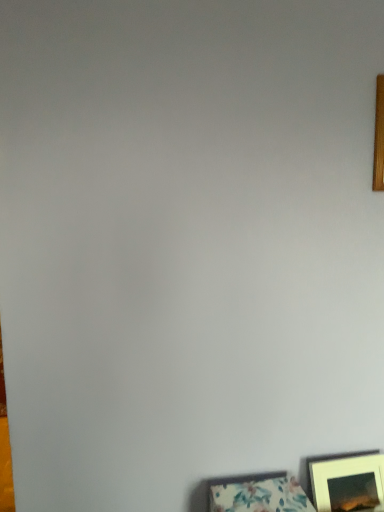
Identify the location of wooden frame at upper right, which is the first picture frame from right to left. The width and height of the screenshot is (384, 512). (379, 137).

The image size is (384, 512). I want to click on floral fabric picture frame at lower right, positioned as the 1th picture frame in bottom-to-top order, so click(259, 494).

In order to face matte white picture frame at lower right, the 2th picture frame viewed from the top, should I rotate leftwards or rightwards?

Rotate your view right by about 21.003°.

Find the location of a particular element. The width and height of the screenshot is (384, 512). wooden frame at upper right, which is the first picture frame from right to left is located at coordinates (379, 137).

In the scene shown: Are floral fabric picture frame at lower right, which is the first picture frame in left-to-right order, and wooden frame at upper right, which is the first picture frame from right to left, beside each other?

floral fabric picture frame at lower right, which is the first picture frame in left-to-right order, is not next to wooden frame at upper right, which is the first picture frame from right to left, and they're not touching.

Is floral fabric picture frame at lower right, which is the first picture frame in left-to-right order, taller or shorter than wooden frame at upper right, positioned as the third picture frame in bottom-to-top order?

floral fabric picture frame at lower right, which is the first picture frame in left-to-right order, is shorter than wooden frame at upper right, positioned as the third picture frame in bottom-to-top order.

Measure the distance between floral fabric picture frame at lower right, positioned as the 1th picture frame in bottom-to-top order, and wooden frame at upper right, the 3th picture frame positioned from the left.

floral fabric picture frame at lower right, positioned as the 1th picture frame in bottom-to-top order, and wooden frame at upper right, the 3th picture frame positioned from the left, are 35.07 inches apart from each other.

Is wooden frame at upper right, which is the first picture frame from right to left, inside floral fabric picture frame at lower right, placed as the 3th picture frame when sorted from top to bottom?

Definitely not — wooden frame at upper right, which is the first picture frame from right to left, is not inside floral fabric picture frame at lower right, placed as the 3th picture frame when sorted from top to bottom.

Does matte white picture frame at lower right, marked as the 2th picture frame in a bottom-to-top arrangement, lie behind floral fabric picture frame at lower right, positioned as the 1th picture frame in bottom-to-top order?

Yes, matte white picture frame at lower right, marked as the 2th picture frame in a bottom-to-top arrangement, is further from the camera.

From the image's perspective, would you say matte white picture frame at lower right, which ranks as the 2th picture frame in left-to-right order, is shown under floral fabric picture frame at lower right, placed as the 3th picture frame when sorted from top to bottom?

No.

In terms of size, does matte white picture frame at lower right, which ranks as the 2th picture frame in right-to-left order, appear bigger or smaller than floral fabric picture frame at lower right, which is the first picture frame in left-to-right order?

matte white picture frame at lower right, which ranks as the 2th picture frame in right-to-left order, is smaller than floral fabric picture frame at lower right, which is the first picture frame in left-to-right order.

Is matte white picture frame at lower right, the 2th picture frame viewed from the top, positioned with its back to floral fabric picture frame at lower right, the third picture frame when ordered from right to left?

No, matte white picture frame at lower right, the 2th picture frame viewed from the top, is not facing away from floral fabric picture frame at lower right, the third picture frame when ordered from right to left.

Which object is closer to the camera taking this photo, wooden frame at upper right, which is the first picture frame from right to left, or matte white picture frame at lower right, which ranks as the 2th picture frame in right-to-left order?

wooden frame at upper right, which is the first picture frame from right to left, is more forward.

From the image's perspective, is wooden frame at upper right, the 3th picture frame positioned from the left, positioned above or below matte white picture frame at lower right, which ranks as the 2th picture frame in right-to-left order?

wooden frame at upper right, the 3th picture frame positioned from the left, is situated higher than matte white picture frame at lower right, which ranks as the 2th picture frame in right-to-left order, in the image.

From a real-world perspective, relative to matte white picture frame at lower right, marked as the 2th picture frame in a bottom-to-top arrangement, is wooden frame at upper right, which is the first picture frame from right to left, vertically above or below?

wooden frame at upper right, which is the first picture frame from right to left, is above matte white picture frame at lower right, marked as the 2th picture frame in a bottom-to-top arrangement.

Is wooden frame at upper right, the 3th picture frame positioned from the left, facing towards matte white picture frame at lower right, marked as the 2th picture frame in a bottom-to-top arrangement?

No, wooden frame at upper right, the 3th picture frame positioned from the left, does not turn towards matte white picture frame at lower right, marked as the 2th picture frame in a bottom-to-top arrangement.

Considering the relative sizes of floral fabric picture frame at lower right, which is the first picture frame in left-to-right order, and matte white picture frame at lower right, which ranks as the 2th picture frame in right-to-left order, in the image provided, is floral fabric picture frame at lower right, which is the first picture frame in left-to-right order, bigger than matte white picture frame at lower right, which ranks as the 2th picture frame in right-to-left order,?

Correct, floral fabric picture frame at lower right, which is the first picture frame in left-to-right order, is larger in size than matte white picture frame at lower right, which ranks as the 2th picture frame in right-to-left order.

From the image's perspective, is floral fabric picture frame at lower right, the third picture frame when ordered from right to left, under matte white picture frame at lower right, which ranks as the 2th picture frame in left-to-right order?

Indeed, from the image's perspective, floral fabric picture frame at lower right, the third picture frame when ordered from right to left, is shown beneath matte white picture frame at lower right, which ranks as the 2th picture frame in left-to-right order.

Is floral fabric picture frame at lower right, positioned as the 1th picture frame in bottom-to-top order, next to matte white picture frame at lower right, which ranks as the 2th picture frame in right-to-left order, and touching it?

They are not placed beside each other.

Is floral fabric picture frame at lower right, placed as the 3th picture frame when sorted from top to bottom, taller than matte white picture frame at lower right, which ranks as the 2th picture frame in left-to-right order?

In fact, floral fabric picture frame at lower right, placed as the 3th picture frame when sorted from top to bottom, may be shorter than matte white picture frame at lower right, which ranks as the 2th picture frame in left-to-right order.

Based on the photo, could you tell me if wooden frame at upper right, which appears as the 1th picture frame when viewed from the top, is facing floral fabric picture frame at lower right, placed as the 3th picture frame when sorted from top to bottom?

No, wooden frame at upper right, which appears as the 1th picture frame when viewed from the top, is not turned towards floral fabric picture frame at lower right, placed as the 3th picture frame when sorted from top to bottom.

Considering the sizes of wooden frame at upper right, which is the first picture frame from right to left, and floral fabric picture frame at lower right, the third picture frame when ordered from right to left, in the image, is wooden frame at upper right, which is the first picture frame from right to left, taller or shorter than floral fabric picture frame at lower right, the third picture frame when ordered from right to left,?

wooden frame at upper right, which is the first picture frame from right to left, is taller than floral fabric picture frame at lower right, the third picture frame when ordered from right to left.

Which of these two, wooden frame at upper right, which is the first picture frame from right to left, or floral fabric picture frame at lower right, positioned as the 1th picture frame in bottom-to-top order, is bigger?

With larger size is floral fabric picture frame at lower right, positioned as the 1th picture frame in bottom-to-top order.

Would you say matte white picture frame at lower right, the 2th picture frame viewed from the top, is outside wooden frame at upper right, the 3th picture frame positioned from the left?

Indeed, matte white picture frame at lower right, the 2th picture frame viewed from the top, is completely outside wooden frame at upper right, the 3th picture frame positioned from the left.

What are the coordinates of `picture frame that is the 1st one below the wooden frame at upper right, which is the first picture frame from right to left (from a real-world perspective)` in the screenshot? It's located at (348, 482).

Is matte white picture frame at lower right, which ranks as the 2th picture frame in left-to-right order, wider or thinner than wooden frame at upper right, which appears as the 1th picture frame when viewed from the top?

matte white picture frame at lower right, which ranks as the 2th picture frame in left-to-right order, is wider than wooden frame at upper right, which appears as the 1th picture frame when viewed from the top.

Is matte white picture frame at lower right, which ranks as the 2th picture frame in left-to-right order, oriented towards wooden frame at upper right, the 3th picture frame positioned from the left?

No, matte white picture frame at lower right, which ranks as the 2th picture frame in left-to-right order, is not oriented towards wooden frame at upper right, the 3th picture frame positioned from the left.

Find the location of a particular element. Image resolution: width=384 pixels, height=512 pixels. the 2nd picture frame to the left of the wooden frame at upper right, positioned as the third picture frame in bottom-to-top order, starting your count from the anchor is located at coordinates (259, 494).

Where is `the 1st picture frame counting from the right of the floral fabric picture frame at lower right, placed as the 3th picture frame when sorted from top to bottom`? The height and width of the screenshot is (512, 384). the 1st picture frame counting from the right of the floral fabric picture frame at lower right, placed as the 3th picture frame when sorted from top to bottom is located at coordinates (348, 482).

Estimate the real-world distances between objects in this image. Which object is closer to wooden frame at upper right, which is the first picture frame from right to left, matte white picture frame at lower right, which ranks as the 2th picture frame in right-to-left order, or floral fabric picture frame at lower right, which is the first picture frame in left-to-right order?

Among the two, matte white picture frame at lower right, which ranks as the 2th picture frame in right-to-left order, is located nearer to wooden frame at upper right, which is the first picture frame from right to left.

Based on their spatial positions, is wooden frame at upper right, which is the first picture frame from right to left, or floral fabric picture frame at lower right, placed as the 3th picture frame when sorted from top to bottom, further from matte white picture frame at lower right, which ranks as the 2th picture frame in right-to-left order?

wooden frame at upper right, which is the first picture frame from right to left, is further to matte white picture frame at lower right, which ranks as the 2th picture frame in right-to-left order.

When comparing their distances from wooden frame at upper right, the 3th picture frame positioned from the left, does floral fabric picture frame at lower right, positioned as the 1th picture frame in bottom-to-top order, or matte white picture frame at lower right, marked as the 2th picture frame in a bottom-to-top arrangement, seem closer?

Based on the image, matte white picture frame at lower right, marked as the 2th picture frame in a bottom-to-top arrangement, appears to be nearer to wooden frame at upper right, the 3th picture frame positioned from the left.

Estimate the real-world distances between objects in this image. Which object is further from floral fabric picture frame at lower right, positioned as the 1th picture frame in bottom-to-top order, wooden frame at upper right, which appears as the 1th picture frame when viewed from the top, or matte white picture frame at lower right, marked as the 2th picture frame in a bottom-to-top arrangement?

wooden frame at upper right, which appears as the 1th picture frame when viewed from the top, lies further to floral fabric picture frame at lower right, positioned as the 1th picture frame in bottom-to-top order, than the other object.

Considering their positions, is floral fabric picture frame at lower right, placed as the 3th picture frame when sorted from top to bottom, positioned closer to matte white picture frame at lower right, marked as the 2th picture frame in a bottom-to-top arrangement, than wooden frame at upper right, positioned as the third picture frame in bottom-to-top order?

floral fabric picture frame at lower right, placed as the 3th picture frame when sorted from top to bottom, is positioned closer to the anchor matte white picture frame at lower right, marked as the 2th picture frame in a bottom-to-top arrangement.

Considering their positions, is matte white picture frame at lower right, which ranks as the 2th picture frame in left-to-right order, positioned closer to floral fabric picture frame at lower right, placed as the 3th picture frame when sorted from top to bottom, than wooden frame at upper right, which appears as the 1th picture frame when viewed from the top?

Among the two, matte white picture frame at lower right, which ranks as the 2th picture frame in left-to-right order, is located nearer to floral fabric picture frame at lower right, placed as the 3th picture frame when sorted from top to bottom.

The height and width of the screenshot is (512, 384). Find the location of `picture frame between wooden frame at upper right, which is the first picture frame from right to left, and floral fabric picture frame at lower right, placed as the 3th picture frame when sorted from top to bottom, from top to bottom`. picture frame between wooden frame at upper right, which is the first picture frame from right to left, and floral fabric picture frame at lower right, placed as the 3th picture frame when sorted from top to bottom, from top to bottom is located at coordinates (348, 482).